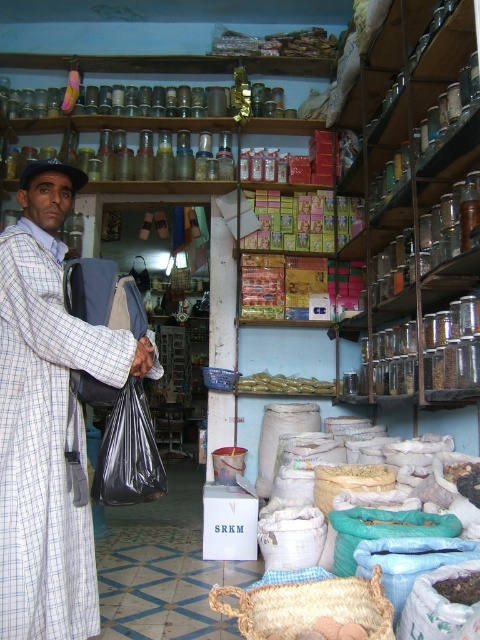
Does plaid fabric man at left have a larger size compared to black plastic bag at left?

Indeed, plaid fabric man at left has a larger size compared to black plastic bag at left.

Is plaid fabric man at left to the left of black plastic bag at left from the viewer's perspective?

Correct, you'll find plaid fabric man at left to the left of black plastic bag at left.

At what (x,y) coordinates should I click in order to perform the action: click on plaid fabric man at left. Please return your answer as a coordinate pair (x, y). Looking at the image, I should click on (48, 419).

Image resolution: width=480 pixels, height=640 pixels. I want to click on plaid fabric man at left, so click(x=48, y=419).

Is plaid fabric man at left to the left of yellowish-green plastic containers at center from the viewer's perspective?

Yes, plaid fabric man at left is to the left of yellowish-green plastic containers at center.

You are a GUI agent. You are given a task and a screenshot of the screen. Output one action in this format:
    pyautogui.click(x=<x>, y=<y>)
    Task: Click on the plaid fabric man at left
    The image size is (480, 640).
    Given the screenshot: What is the action you would take?
    pyautogui.click(x=48, y=419)

This screenshot has width=480, height=640. I want to click on plaid fabric man at left, so click(48, 419).

Can you confirm if black plastic bag at left is positioned below yellowish-green plastic containers at center?

No, black plastic bag at left is not below yellowish-green plastic containers at center.

Does point (139, 420) come in front of point (311, 378)?

That is True.

The height and width of the screenshot is (640, 480). What are the coordinates of `black plastic bag at left` in the screenshot? It's located at (129, 452).